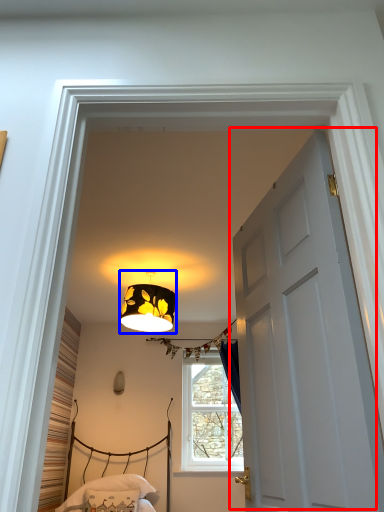
Question: Which object appears farthest to the camera in this image, door (highlighted by a red box) or lamp (highlighted by a blue box)?

Choices:
 (A) door
 (B) lamp

Answer: (B)